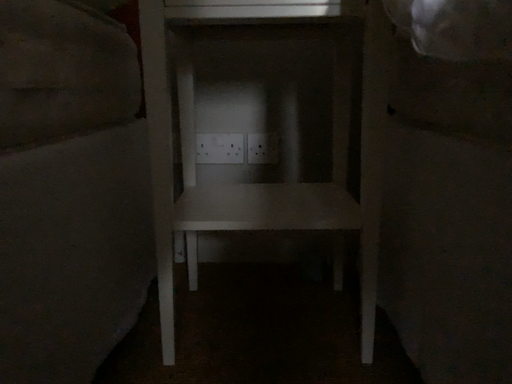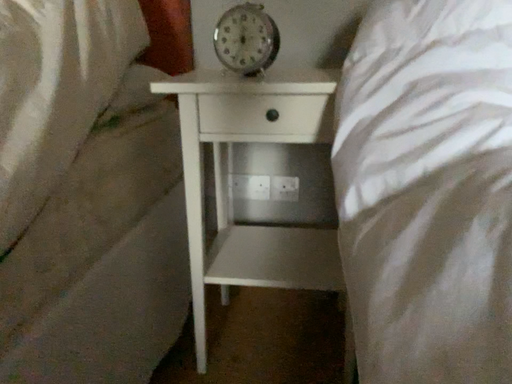
Question: Which way did the camera rotate in the video?

Choices:
 (A) rotated left
 (B) rotated right

Answer: (A)